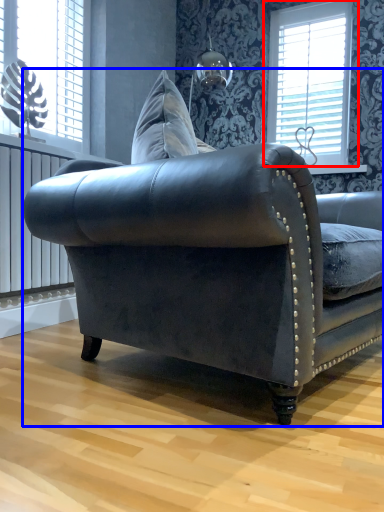
Question: Which object appears farthest to the camera in this image, window (highlighted by a red box) or studio couch (highlighted by a blue box)?

Choices:
 (A) window
 (B) studio couch

Answer: (A)